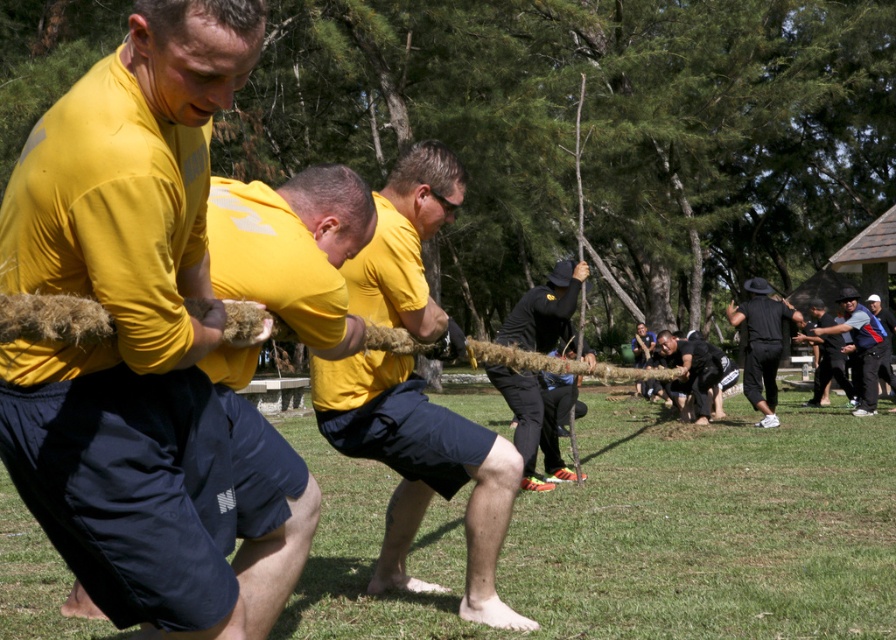
You are a photographer trying to capture a clear shot of both the black matte baseball cap at center and the black matte hat at upper right. Since you want both objects to appear in focus, which one should you focus on first to ensure depth of field covers both?

The black matte baseball cap at center is shorter than the black matte hat at upper right, so you should focus on the black matte hat at upper right first to ensure depth of field covers both.

You are a photographer at the tug of war event. You want to capture a photo of the black matte baseball cap at center and the black matte hat at upper right in the same frame. Which object should you focus on first if you want to include both in the frame without moving the camera?

You should focus on the black matte hat at upper right first because it has a greater width than the black matte baseball cap at center, allowing it to be captured in the frame more easily while keeping the camera stationary.

You are a photographer trying to capture a closeup of the participants in the tug of war. You notice the matte yellow shirt at center and the dark blue jeans at center. Which clothing item is closer to the camera?

The matte yellow shirt at center is positioned over dark blue jeans at center, so the matte yellow shirt at center is closer to the camera.